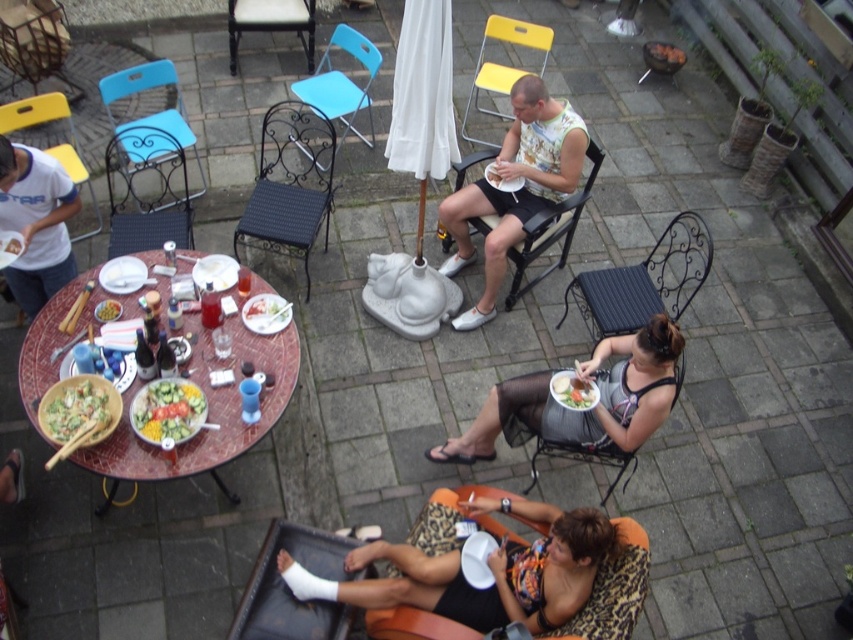
Question: Which is farther from the black wrought iron chair at center?

Choices:
 (A) light blue plastic chair at upper left
 (B) matte gray dress at lower center
 (C) marble table at center
 (D) green leafy salad at lower center

Answer: (A)

Question: Does wrought iron chair at center appear on the right side of green matte bowl at center?

Choices:
 (A) no
 (B) yes

Answer: (B)

Question: Which point is farther to the camera?

Choices:
 (A) (399, 125)
 (B) (329, 589)
 (C) (282, 230)
 (D) (535, 26)

Answer: (D)

Question: Is leather-patterned chair at lower center to the right of black mesh chair at lower center from the viewer's perspective?

Choices:
 (A) yes
 (B) no

Answer: (B)

Question: Which of these objects is positioned closest to the matte plastic chair at center?

Choices:
 (A) green leafy salad at center
 (B) matte blue chair at upper left
 (C) black wrought iron chair at center
 (D) marble table at center

Answer: (B)

Question: Can you confirm if leather-patterned chair at lower center is bigger than matte plastic chair at center?

Choices:
 (A) yes
 (B) no

Answer: (B)